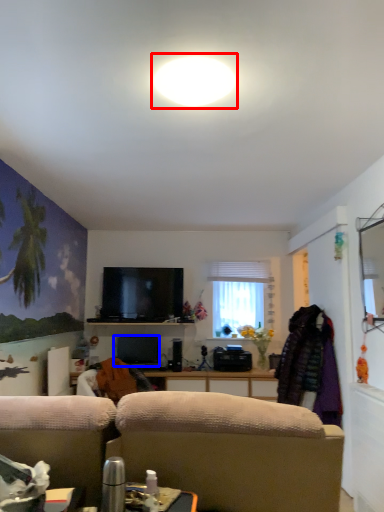
Question: Which object is closer to the camera taking this photo, bright (highlighted by a red box) or television (highlighted by a blue box)?

Choices:
 (A) bright
 (B) television

Answer: (A)